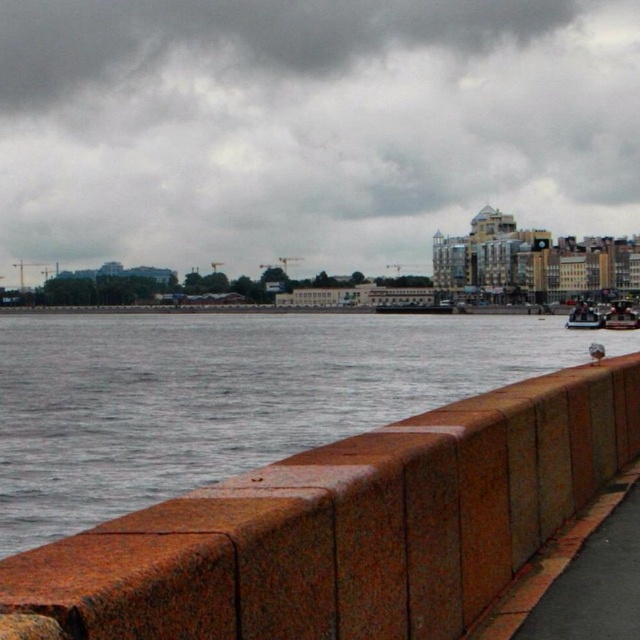
Can you confirm if cloudy gray sky at upper center is bigger than wooden polished boat at right?

Yes.

Measure the distance between cloudy gray sky at upper center and camera.

cloudy gray sky at upper center and camera are 238.85 meters apart from each other.

The image size is (640, 640). Describe the element at coordinates (308, 128) in the screenshot. I see `cloudy gray sky at upper center` at that location.

Identify the location of cloudy gray sky at upper center. (308, 128).

Does cloudy gray sky at upper center have a larger size compared to metallic silver boat at lower right?

Yes, cloudy gray sky at upper center is bigger than metallic silver boat at lower right.

Can you confirm if cloudy gray sky at upper center is taller than metallic silver boat at lower right?

Yes.

Where is `cloudy gray sky at upper center`? cloudy gray sky at upper center is located at coordinates (308, 128).

What do you see at coordinates (349, 525) in the screenshot? I see `rustic stone barrier at lower center` at bounding box center [349, 525].

Who is more distant from viewer, (166, 538) or (579, 316)?

The point (579, 316) is more distant.

This screenshot has height=640, width=640. I want to click on rustic stone barrier at lower center, so click(349, 525).